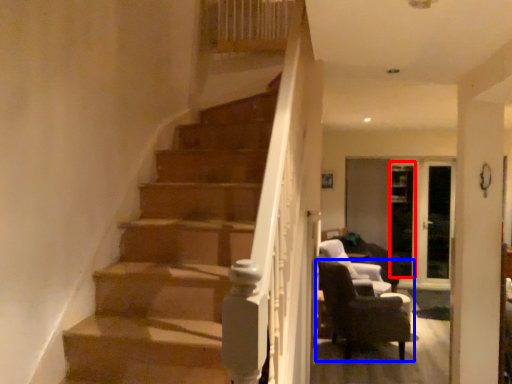
Question: Which of the following is the closest to the observer, glass door (highlighted by a red box) or chair (highlighted by a blue box)?

Choices:
 (A) glass door
 (B) chair

Answer: (B)